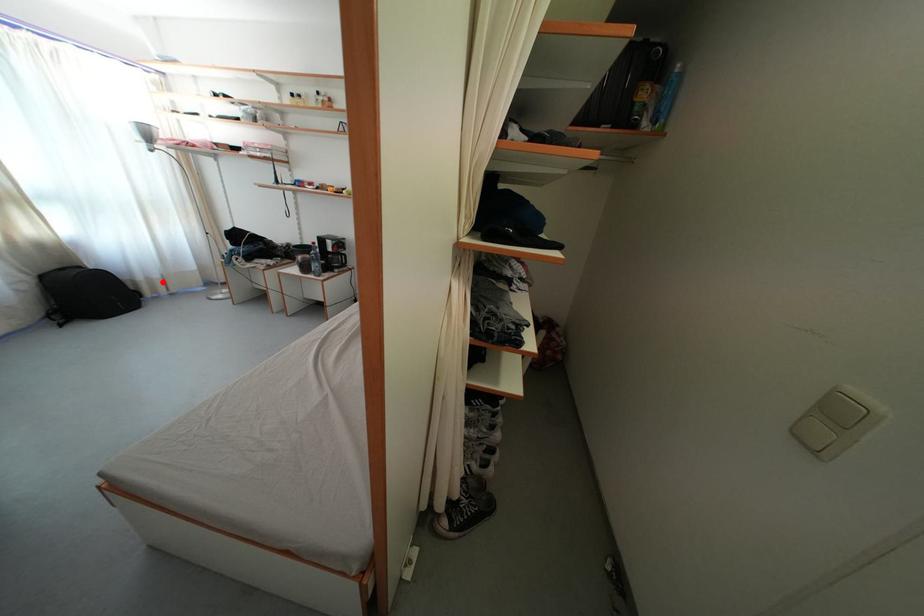
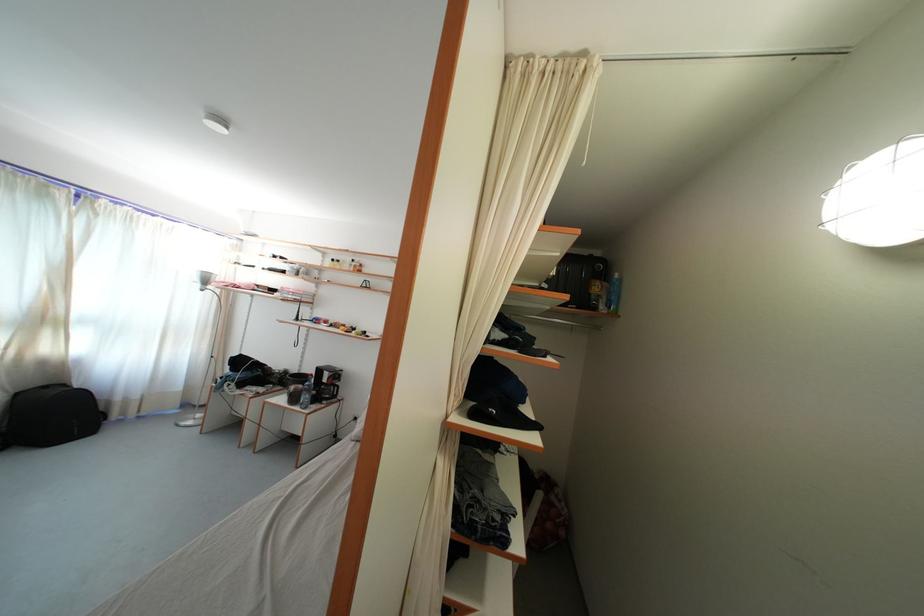
Question: I am providing you with two images of the same scene from different viewpoints. In image1, a red point is highlighted. Considering the same 3D point in image2, which of the following is correct?

Choices:
 (A) It is closer
 (B) It is farther

Answer: (A)